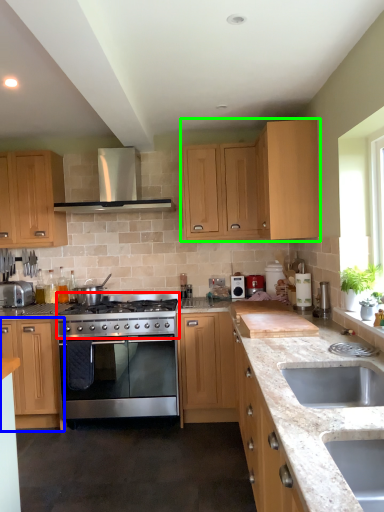
Question: Estimate the real-world distances between objects in this image. Which object is farther from gas stove (highlighted by a red box), cabinetry (highlighted by a blue box) or cabinetry (highlighted by a green box)?

Choices:
 (A) cabinetry
 (B) cabinetry

Answer: (B)